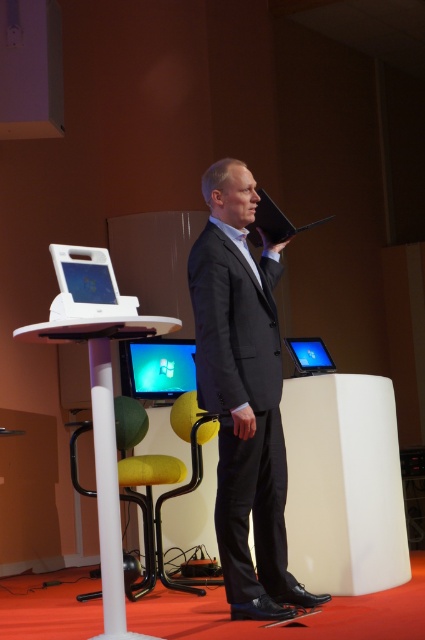
You are an event organizer and need to place a new microphone stand in the conference room. The stand requires a 0.5 meter radius space around it. Is there enough space at point [274,221] where the black glossy laptop at upper center is located?

The black glossy laptop at upper center is located at point [274,221]. Since the microphone stand requires a 0.5 meter radius and the laptop is already at that point, placing the stand there would not leave enough space. Choose another location.

You are a stage designer planning to place a decorative banner between the dark gray suit at center and the white plastic laptop at center. Which object should the banner be closer to if you want it to be equidistant from both objects?

The banner should be placed closer to the white plastic laptop at center since the dark gray suit at center might be wider than the white plastic laptop at center, requiring more space to maintain equal distance.